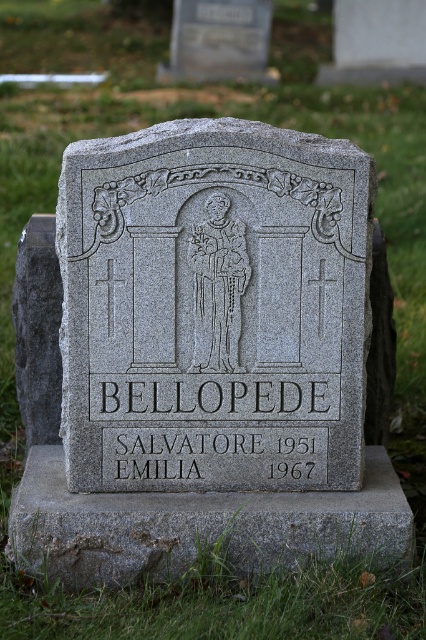
You are standing in front of a gravestone in a cemetery. You notice a point marked at coordinates [213,308]. Based on the scene description, can you identify what this point corresponds to?

The point at coordinates [213,308] corresponds to the gray granite gravestone at center.